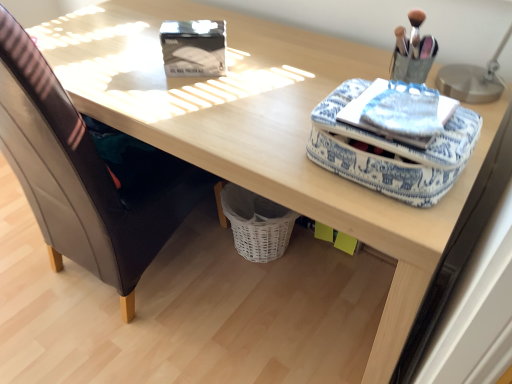
Question: Could you tell me if blue fabric case at upper right is turned towards leather at left?

Choices:
 (A) no
 (B) yes

Answer: (A)

Question: Is blue fabric case at upper right at the right side of leather at left?

Choices:
 (A) yes
 (B) no

Answer: (A)

Question: Does blue fabric case at upper right appear on the left side of leather at left?

Choices:
 (A) yes
 (B) no

Answer: (B)

Question: From the image's perspective, would you say blue fabric case at upper right is positioned over leather at left?

Choices:
 (A) no
 (B) yes

Answer: (A)

Question: Does blue fabric case at upper right have a lesser height compared to leather at left?

Choices:
 (A) yes
 (B) no

Answer: (A)

Question: Considering the positions of blue fabric case at upper right and leather at left in the image, is blue fabric case at upper right wider or thinner than leather at left?

Choices:
 (A) thin
 (B) wide

Answer: (A)

Question: Is blue fabric case at upper right bigger or smaller than leather at left?

Choices:
 (A) big
 (B) small

Answer: (B)

Question: Based on their positions, is blue fabric case at upper right located to the left or right of leather at left?

Choices:
 (A) left
 (B) right

Answer: (B)

Question: Is point (429, 192) closer or farther from the camera than point (74, 150)?

Choices:
 (A) closer
 (B) farther

Answer: (A)

Question: From a real-world perspective, is metallic silver table lamp at upper right above or below matte black storage box at upper center?

Choices:
 (A) below
 (B) above

Answer: (B)

Question: From the image's perspective, is metallic silver table lamp at upper right located above or below matte black storage box at upper center?

Choices:
 (A) above
 (B) below

Answer: (B)

Question: From their relative heights in the image, would you say metallic silver table lamp at upper right is taller or shorter than matte black storage box at upper center?

Choices:
 (A) tall
 (B) short

Answer: (A)

Question: Considering the relative positions of metallic silver table lamp at upper right and matte black storage box at upper center in the image provided, is metallic silver table lamp at upper right to the left or to the right of matte black storage box at upper center?

Choices:
 (A) right
 (B) left

Answer: (A)

Question: Is blue printed fabric notepad at upper right taller or shorter than leather at left?

Choices:
 (A) tall
 (B) short

Answer: (B)

Question: In terms of width, does blue printed fabric notepad at upper right look wider or thinner when compared to leather at left?

Choices:
 (A) thin
 (B) wide

Answer: (A)